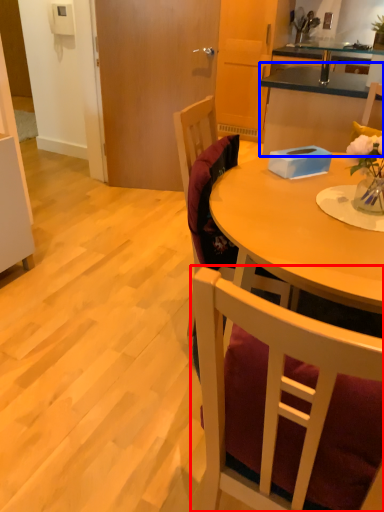
Question: Which point is closer to the camera, chair (highlighted by a red box) or cabinetry (highlighted by a blue box)?

Choices:
 (A) chair
 (B) cabinetry

Answer: (A)